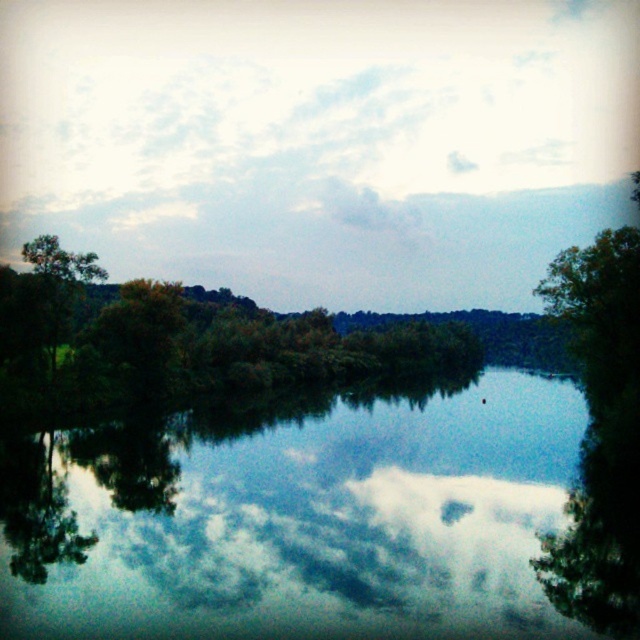
Is point (637, 401) behind point (132, 433)?

No, (637, 401) is closer to viewer.

Can you confirm if green leafy tree at right is wider than green leafy trees at lower left?

Indeed, green leafy tree at right has a greater width compared to green leafy trees at lower left.

I want to click on green leafy tree at right, so click(600, 435).

Does transparent glass water at center have a greater height compared to green leafy trees at lower left?

Yes, transparent glass water at center is taller than green leafy trees at lower left.

Between transparent glass water at center and green leafy trees at lower left, which one is positioned lower?

transparent glass water at center is lower down.

The width and height of the screenshot is (640, 640). Describe the element at coordinates (298, 518) in the screenshot. I see `transparent glass water at center` at that location.

At what (x,y) coordinates should I click in order to perform the action: click on transparent glass water at center. Please return your answer as a coordinate pair (x, y). The height and width of the screenshot is (640, 640). Looking at the image, I should click on (298, 518).

Between transparent glass water at center and green leafy tree at right, which one has more height?

green leafy tree at right

Which is in front, point (228, 628) or point (579, 356)?

Positioned in front is point (228, 628).

Identify the location of transparent glass water at center. (298, 518).

Where is `transparent glass water at center`? transparent glass water at center is located at coordinates (298, 518).